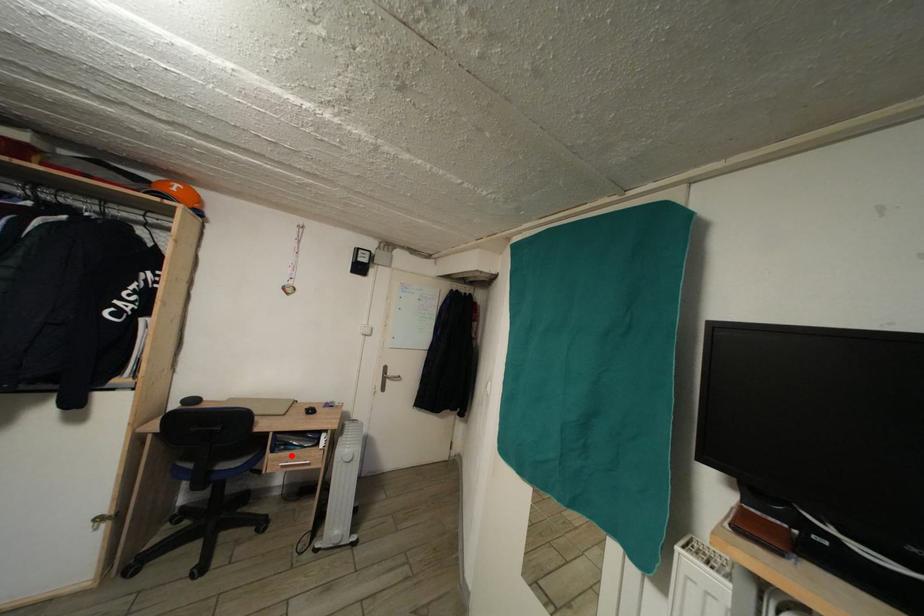
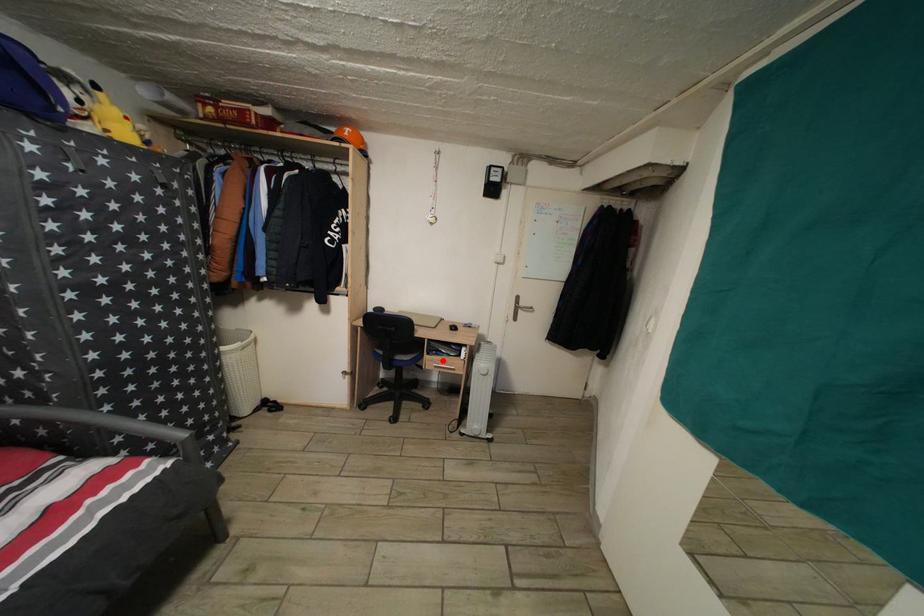
I am providing you with two images of the same scene from different viewpoints. A red point is marked on the first image and another point is marked on the second image. Is the red point in image1 aligned with the point shown in image2?

Yes